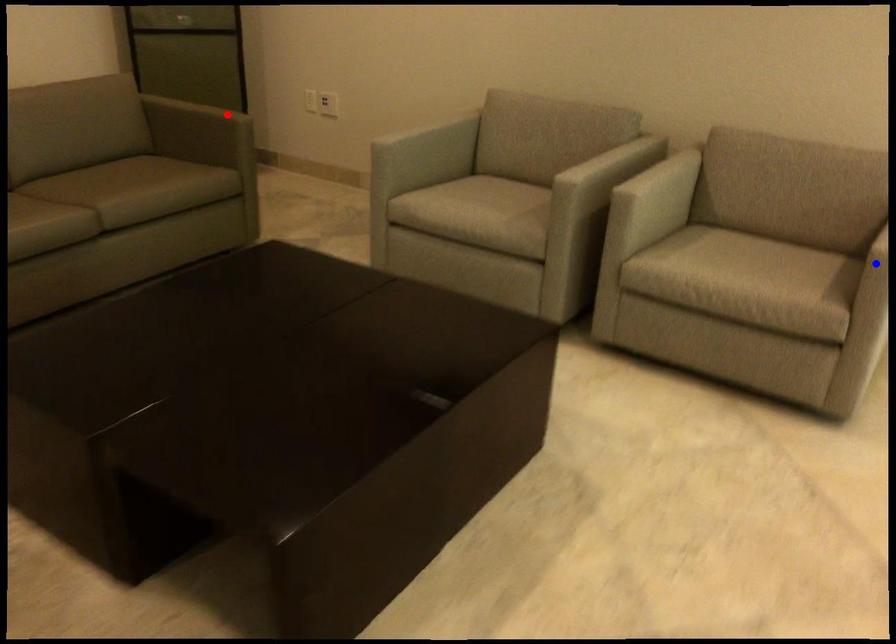
Question: Two points are marked on the image. Which point is closer to the camera?

Choices:
 (A) Blue point is closer.
 (B) Red point is closer.

Answer: (A)